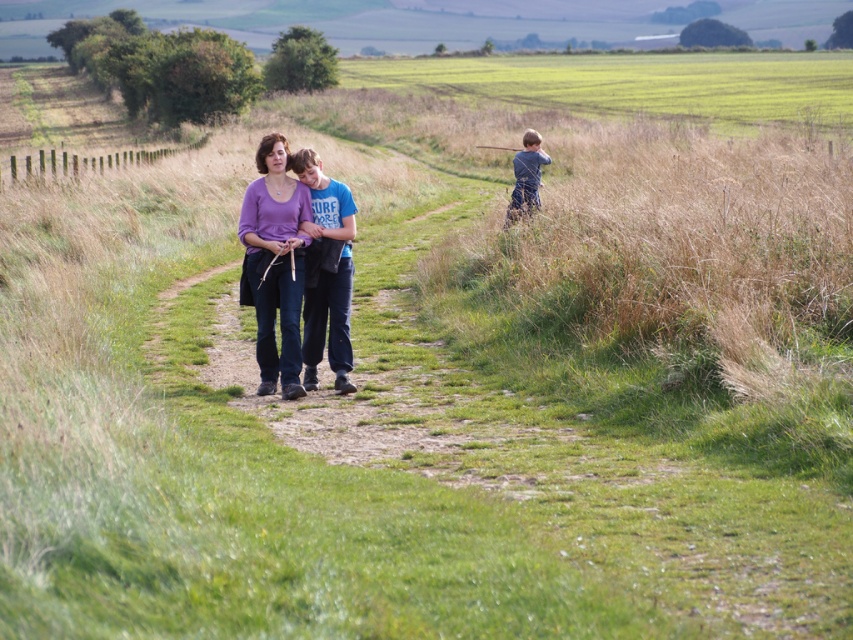
Question: Which point is farther to the camera?

Choices:
 (A) (323, 260)
 (B) (296, 284)

Answer: (A)

Question: Considering the real-world distances, which object is farthest from the blue denim jeans at right?

Choices:
 (A) purple matte shirt at center
 (B) blue t-shirt at center

Answer: (A)

Question: Is purple matte shirt at center to the right of blue denim jeans at right from the viewer's perspective?

Choices:
 (A) yes
 (B) no

Answer: (B)

Question: Does blue t-shirt at center have a smaller size compared to blue denim jeans at right?

Choices:
 (A) no
 (B) yes

Answer: (B)

Question: Which point is farther from the camera taking this photo?

Choices:
 (A) (521, 163)
 (B) (335, 349)
 (C) (280, 260)

Answer: (A)

Question: Is purple matte shirt at center above blue denim jeans at right?

Choices:
 (A) no
 (B) yes

Answer: (A)